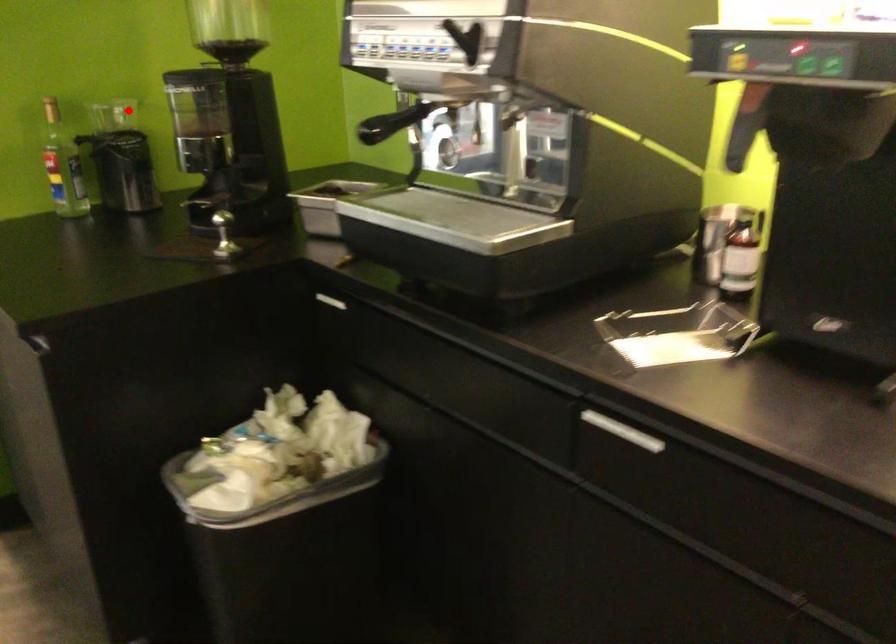
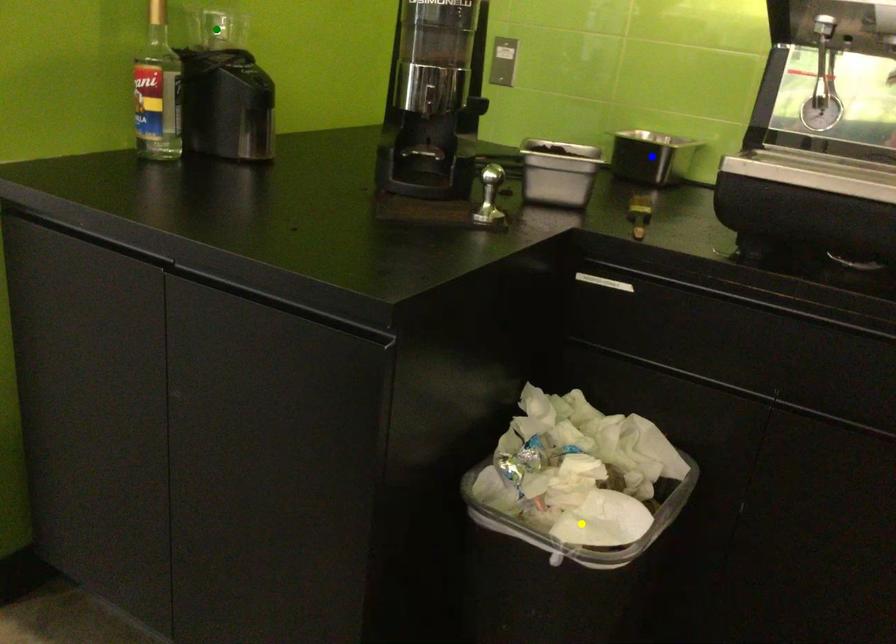
Question: I am providing you with two images of the same scene from different viewpoints. A red point is marked on the first image. You are given multiple points on the second image. Which spot in image 2 lines up with the point in image 1?

Choices:
 (A) green point
 (B) yellow point
 (C) blue point

Answer: (A)